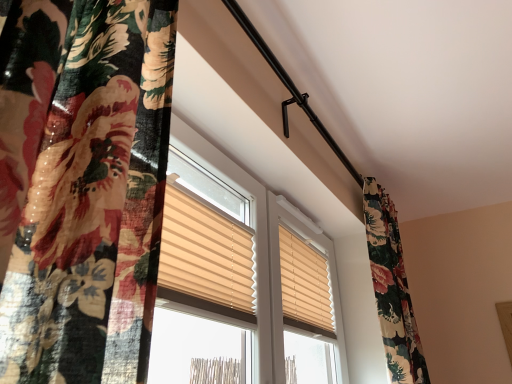
Question: Is floral fabric curtain at left in front of or behind beige fabric window blind at center in the image?

Choices:
 (A) behind
 (B) front

Answer: (B)

Question: In terms of height, does floral fabric curtain at left look taller or shorter compared to beige fabric window blind at center?

Choices:
 (A) tall
 (B) short

Answer: (A)

Question: Is point (130, 13) positioned closer to the camera than point (308, 248)?

Choices:
 (A) farther
 (B) closer

Answer: (B)

Question: Is beige fabric window blind at center spatially inside floral fabric curtain at left, or outside of it?

Choices:
 (A) inside
 (B) outside

Answer: (A)

Question: Considering their positions, is beige fabric window blind at center located in front of or behind floral fabric curtain at left?

Choices:
 (A) behind
 (B) front

Answer: (A)

Question: From the image's perspective, relative to floral fabric curtain at left, is beige fabric window blind at center above or below?

Choices:
 (A) above
 (B) below

Answer: (B)

Question: In the image, is beige fabric window blind at center on the left side or the right side of floral fabric curtain at left?

Choices:
 (A) right
 (B) left

Answer: (A)